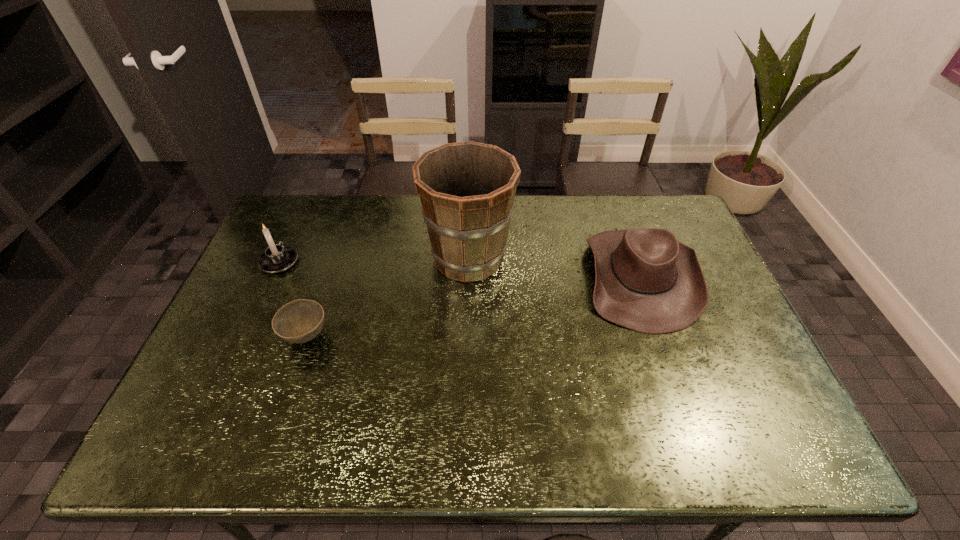
The height and width of the screenshot is (540, 960). Identify the location of the third object from left to right. (467, 189).

Where is `the tallest object`? The height and width of the screenshot is (540, 960). the tallest object is located at coordinates (467, 189).

The image size is (960, 540). Find the location of `the leftmost object`. the leftmost object is located at coordinates (277, 258).

Identify the location of cowboy hat. The height and width of the screenshot is (540, 960). (646, 280).

This screenshot has width=960, height=540. In order to click on bowl in this screenshot , I will do `click(299, 321)`.

Locate an element on the screen. Image resolution: width=960 pixels, height=540 pixels. the second object from left to right is located at coordinates (299, 321).

At what (x,y) coordinates should I click in order to perform the action: click on vacant region located 0.100m on the back of the bucket. Please return your answer as a coordinate pair (x, y). The image size is (960, 540). Looking at the image, I should click on (469, 211).

The width and height of the screenshot is (960, 540). Find the location of `vacant space located with a handle on the side of the candle holder`. vacant space located with a handle on the side of the candle holder is located at coordinates (302, 211).

This screenshot has height=540, width=960. I want to click on free space located 0.160m with a handle on the side of the candle holder, so click(x=300, y=218).

At what (x,y) coordinates should I click in order to perform the action: click on free space located with a handle on the side of the candle holder. Please return your answer as a coordinate pair (x, y). Looking at the image, I should click on (304, 208).